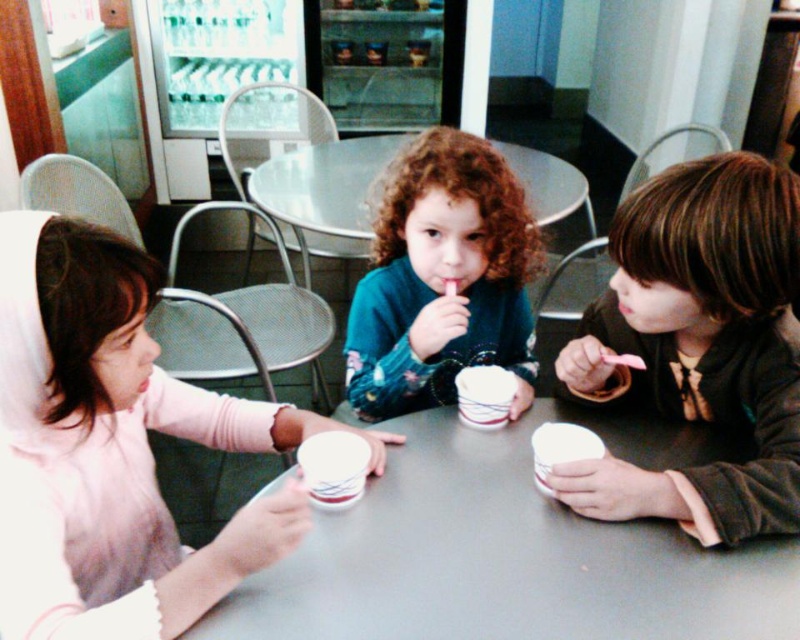
Question: Can you confirm if pink matte cupcake at center is smaller than teal floral sweater at center?

Choices:
 (A) yes
 (B) no

Answer: (B)

Question: Considering the relative positions of pink matte cupcake at center and teal floral sweater at center in the image provided, where is pink matte cupcake at center located with respect to teal floral sweater at center?

Choices:
 (A) right
 (B) left

Answer: (B)

Question: Which is nearer to the white plastic table at center?

Choices:
 (A) pink matte cupcake at center
 (B) teal floral sweater at center
 (C) brown matte jacket at right

Answer: (C)

Question: Can you confirm if white plastic table at center is positioned below teal floral sweater at center?

Choices:
 (A) no
 (B) yes

Answer: (B)

Question: Which object is positioned closest to the teal floral sweater at center?

Choices:
 (A) white plastic table at center
 (B) brown matte jacket at right

Answer: (B)

Question: Considering the real-world distances, which object is closest to the brown matte jacket at right?

Choices:
 (A) teal floral sweater at center
 (B) pink matte cupcake at center

Answer: (A)